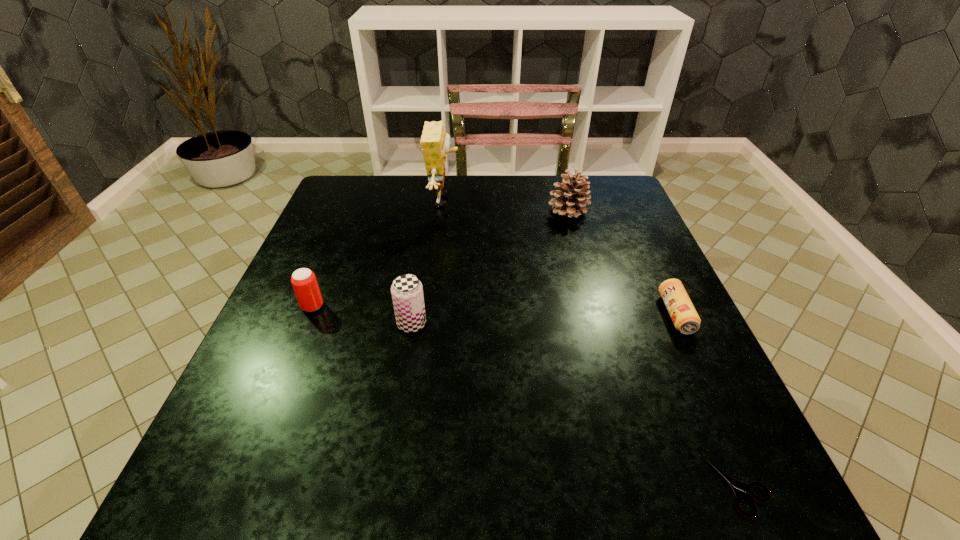
Find the location of a particular element. The width and height of the screenshot is (960, 540). empty space between the third shortest object and the pinecone is located at coordinates (441, 258).

Image resolution: width=960 pixels, height=540 pixels. In order to click on free area in between the shortest object and the pinecone in this screenshot , I will do `click(654, 349)`.

Find the location of a particular element. This screenshot has height=540, width=960. vacant region between the rightmost beer can and the shears is located at coordinates (708, 401).

Locate an element on the screen. The image size is (960, 540). vacant space in between the shortest beer can and the tallest beer can is located at coordinates (543, 319).

Identify the location of empty space between the tallest beer can and the tallest object. The image size is (960, 540). (428, 262).

Where is `free space that is in between the second shortest beer can and the fourth object from left to right`? free space that is in between the second shortest beer can and the fourth object from left to right is located at coordinates (441, 258).

This screenshot has width=960, height=540. In order to click on free spot between the tallest object and the second beer can from right to left in this screenshot , I will do `click(428, 262)`.

Identify the location of vacant region between the tallest object and the second beer can from left to right. The image size is (960, 540). (428, 262).

At what (x,y) coordinates should I click in order to perform the action: click on vacant space that is in between the pinecone and the rightmost beer can. Please return your answer as a coordinate pair (x, y). The width and height of the screenshot is (960, 540). Looking at the image, I should click on (622, 262).

At what (x,y) coordinates should I click in order to perform the action: click on object that is the third closest to the third object from right to left. Please return your answer as a coordinate pair (x, y). This screenshot has height=540, width=960. Looking at the image, I should click on (407, 292).